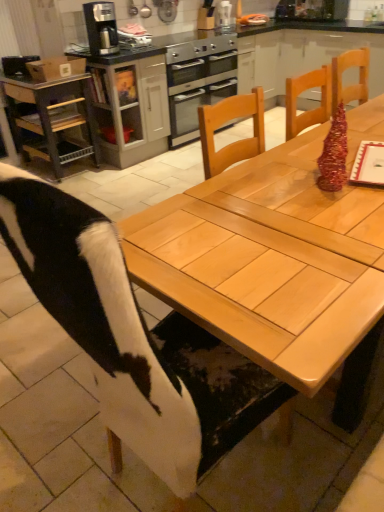
Question: From their relative heights in the image, would you say stainless steel oven at center is taller or shorter than metallic gray cart at left?

Choices:
 (A) short
 (B) tall

Answer: (A)

Question: From the image's perspective, relative to metallic gray cart at left, is stainless steel oven at center above or below?

Choices:
 (A) below
 (B) above

Answer: (B)

Question: Which object is the farthest from the metallic silver toaster at upper center?

Choices:
 (A) metallic gray cart at left
 (B) stainless steel oven at center
 (C) cowhide at center
 (D) satin black coffee maker at upper left
 (E) natural wood table at center

Answer: (C)

Question: Which object is the farthest from the satin black coffee maker at upper left?

Choices:
 (A) metallic silver toaster at upper center
 (B) cowhide at center
 (C) metallic gray cart at left
 (D) natural wood table at center
 (E) stainless steel oven at center

Answer: (B)